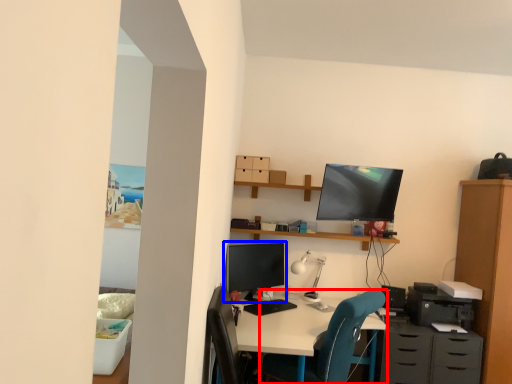
Question: Which object is closer to the camera taking this photo, chair (highlighted by a red box) or computer monitor (highlighted by a blue box)?

Choices:
 (A) chair
 (B) computer monitor

Answer: (A)